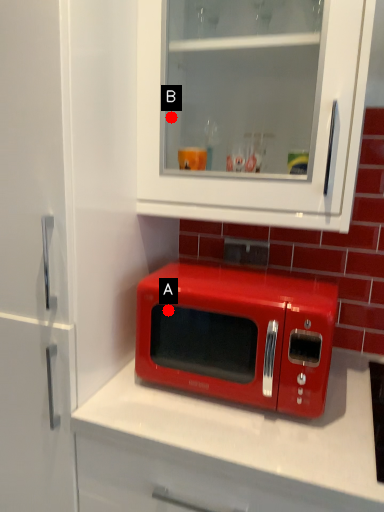
Question: Two points are circled on the image, labeled by A and B beside each circle. Which of the following is the closest to the observer?

Choices:
 (A) A is closer
 (B) B is closer

Answer: (B)